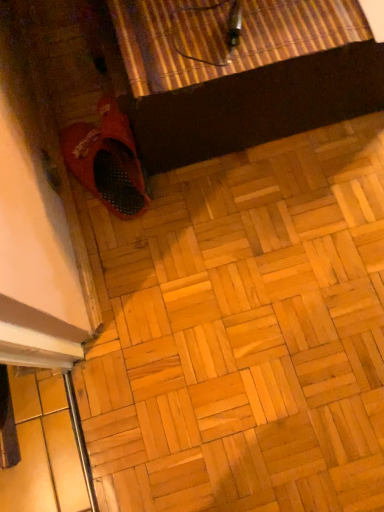
Question: In terms of height, does matte black cat litter box at lower left look taller or shorter compared to matte red shoe at lower left?

Choices:
 (A) tall
 (B) short

Answer: (B)

Question: In terms of size, does matte black cat litter box at lower left appear bigger or smaller than matte red shoe at lower left?

Choices:
 (A) big
 (B) small

Answer: (A)

Question: Looking at their shapes, would you say matte black cat litter box at lower left is wider or thinner than matte red shoe at lower left?

Choices:
 (A) thin
 (B) wide

Answer: (B)

Question: Is matte red shoe at lower left wider or thinner than matte black cat litter box at lower left?

Choices:
 (A) wide
 (B) thin

Answer: (B)

Question: From the image's perspective, relative to matte black cat litter box at lower left, is matte red shoe at lower left above or below?

Choices:
 (A) above
 (B) below

Answer: (A)

Question: From a real-world perspective, relative to matte black cat litter box at lower left, is matte red shoe at lower left vertically above or below?

Choices:
 (A) below
 (B) above

Answer: (B)

Question: From their relative heights in the image, would you say matte red shoe at lower left is taller or shorter than matte black cat litter box at lower left?

Choices:
 (A) tall
 (B) short

Answer: (A)